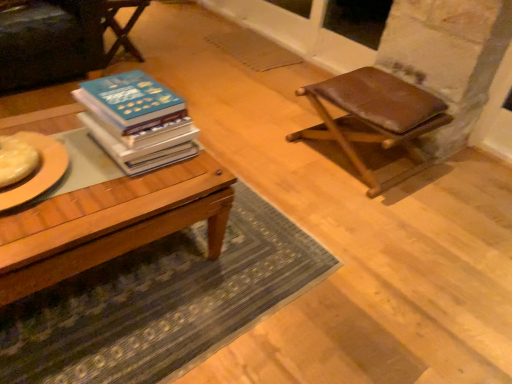
Find the location of `free space above hardcover books at center (from a real-world perspective)`. free space above hardcover books at center (from a real-world perspective) is located at coordinates (128, 100).